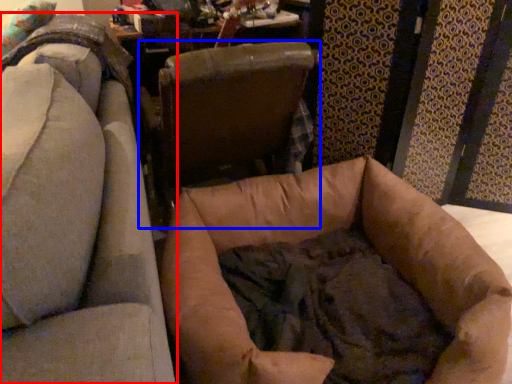
Question: Among these objects, which one is nearest to the camera, chair (highlighted by a red box) or chair (highlighted by a blue box)?

Choices:
 (A) chair
 (B) chair

Answer: (A)